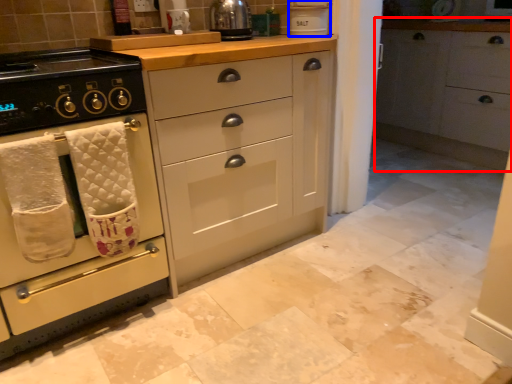
Question: Which of the following is the farthest to the observer, cabinetry (highlighted by a red box) or appliance (highlighted by a blue box)?

Choices:
 (A) cabinetry
 (B) appliance

Answer: (A)